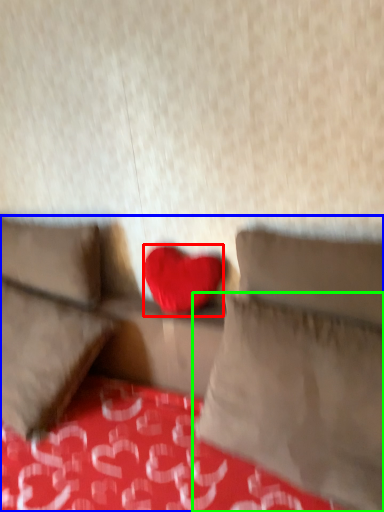
Question: Which is farther away from heart (highlighted by a red box)? studio couch (highlighted by a blue box) or pillow (highlighted by a green box)?

Choices:
 (A) studio couch
 (B) pillow

Answer: (B)